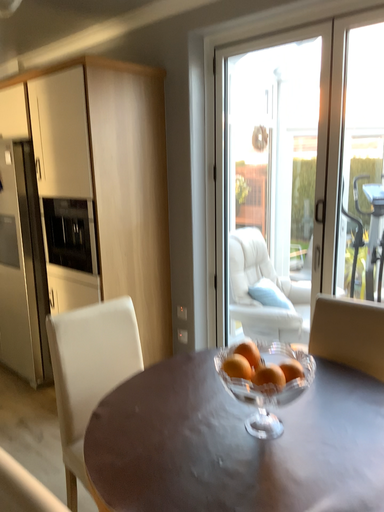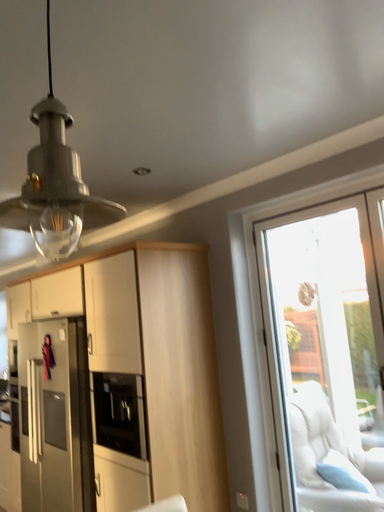
Question: How did the camera likely rotate when shooting the video?

Choices:
 (A) rotated right
 (B) rotated left

Answer: (B)